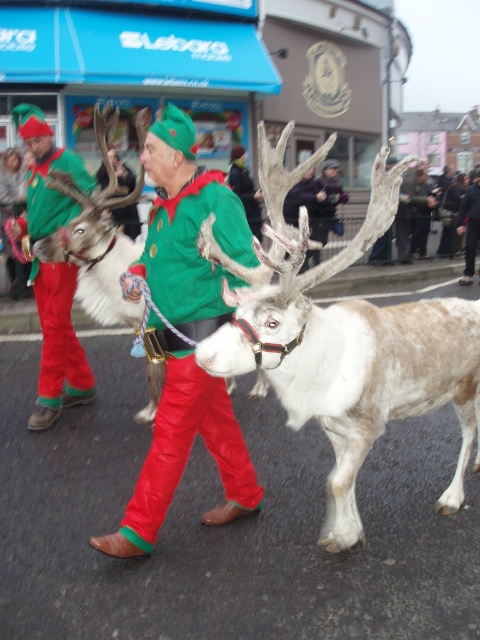
Is white speckled fur at center positioned behind matte green costume at center?

No.

Is white speckled fur at center above matte green costume at center?

No, white speckled fur at center is not above matte green costume at center.

Between point (231, 301) and point (50, 301), which one is positioned in front?

Point (231, 301)

The height and width of the screenshot is (640, 480). I want to click on white speckled fur at center, so click(343, 340).